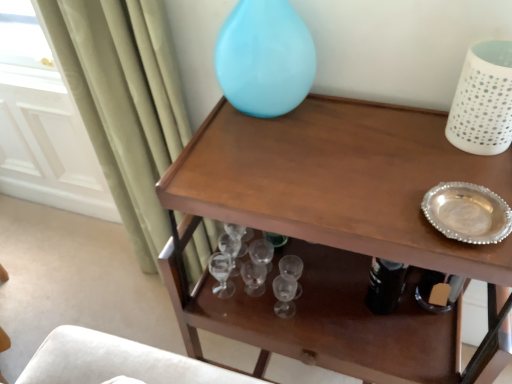
Question: Considering the relative sizes of wooden table at upper center and glossy glass vase at upper center, marked as the 2th vase in a right-to-left arrangement, in the image provided, is wooden table at upper center shorter than glossy glass vase at upper center, marked as the 2th vase in a right-to-left arrangement,?

Choices:
 (A) no
 (B) yes

Answer: (A)

Question: Can you confirm if wooden table at upper center is smaller than glossy glass vase at upper center, marked as the 2th vase in a right-to-left arrangement?

Choices:
 (A) yes
 (B) no

Answer: (B)

Question: Is wooden table at upper center bigger than glossy glass vase at upper center, the first vase in the left-to-right sequence?

Choices:
 (A) yes
 (B) no

Answer: (A)

Question: Is wooden table at upper center further to camera compared to glossy glass vase at upper center, marked as the 2th vase in a right-to-left arrangement?

Choices:
 (A) no
 (B) yes

Answer: (A)

Question: Is the position of wooden table at upper center less distant than that of glossy glass vase at upper center, marked as the 2th vase in a right-to-left arrangement?

Choices:
 (A) no
 (B) yes

Answer: (B)

Question: From the image's perspective, relative to glossy glass vase at upper center, marked as the 2th vase in a right-to-left arrangement, is white perforated vase at upper right, the second vase positioned from the left, above or below?

Choices:
 (A) above
 (B) below

Answer: (B)

Question: Would you say white perforated vase at upper right, the second vase positioned from the left, is to the left or to the right of glossy glass vase at upper center, the first vase in the left-to-right sequence, in the picture?

Choices:
 (A) right
 (B) left

Answer: (A)

Question: From their relative heights in the image, would you say white perforated vase at upper right, the second vase positioned from the left, is taller or shorter than glossy glass vase at upper center, the first vase in the left-to-right sequence?

Choices:
 (A) tall
 (B) short

Answer: (B)

Question: Considering the positions of white perforated vase at upper right, which is counted as the 1th vase, starting from the right, and glossy glass vase at upper center, marked as the 2th vase in a right-to-left arrangement, in the image, is white perforated vase at upper right, which is counted as the 1th vase, starting from the right, wider or thinner than glossy glass vase at upper center, marked as the 2th vase in a right-to-left arrangement,?

Choices:
 (A) thin
 (B) wide

Answer: (B)

Question: From the image's perspective, is glossy glass vase at upper center, the first vase in the left-to-right sequence, located above or below white perforated vase at upper right, the second vase positioned from the left?

Choices:
 (A) above
 (B) below

Answer: (A)

Question: In the image, is glossy glass vase at upper center, marked as the 2th vase in a right-to-left arrangement, on the left side or the right side of white perforated vase at upper right, which is counted as the 1th vase, starting from the right?

Choices:
 (A) right
 (B) left

Answer: (B)

Question: From a real-world perspective, is glossy glass vase at upper center, marked as the 2th vase in a right-to-left arrangement, above or below white perforated vase at upper right, the second vase positioned from the left?

Choices:
 (A) below
 (B) above

Answer: (B)

Question: In terms of size, does glossy glass vase at upper center, the first vase in the left-to-right sequence, appear bigger or smaller than white perforated vase at upper right, which is counted as the 1th vase, starting from the right?

Choices:
 (A) small
 (B) big

Answer: (B)

Question: From a real-world perspective, relative to wooden table at upper center, is white perforated vase at upper right, the second vase positioned from the left, vertically above or below?

Choices:
 (A) above
 (B) below

Answer: (A)

Question: Is white perforated vase at upper right, which is counted as the 1th vase, starting from the right, inside the boundaries of wooden table at upper center, or outside?

Choices:
 (A) inside
 (B) outside

Answer: (B)